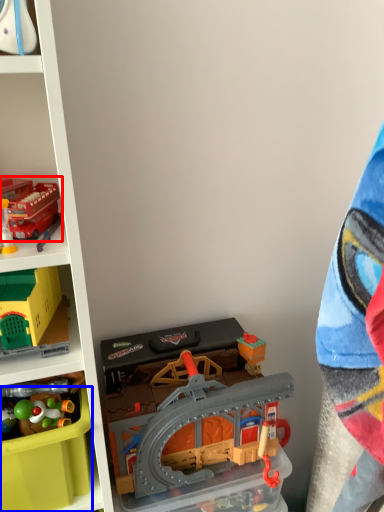
Question: Which point is closer to the camera, toy (highlighted by a red box) or storage box (highlighted by a blue box)?

Choices:
 (A) toy
 (B) storage box

Answer: (A)